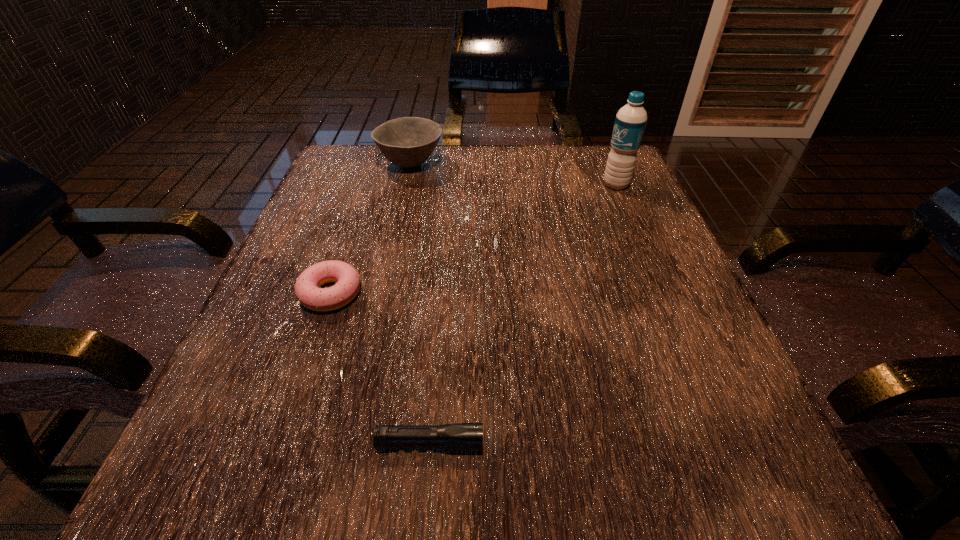
This screenshot has height=540, width=960. Find the location of `free space between the flashlight and the third farthest object`. free space between the flashlight and the third farthest object is located at coordinates click(380, 368).

Locate an element on the screen. The height and width of the screenshot is (540, 960). empty space between the water bottle and the third shortest object is located at coordinates (514, 174).

Identify the location of vacant area between the tallest object and the nearest object. (523, 314).

Locate an element on the screen. The height and width of the screenshot is (540, 960). vacant area between the third tallest object and the bowl is located at coordinates (371, 228).

Locate an element on the screen. unoccupied area between the second tallest object and the rightmost object is located at coordinates (514, 174).

Identify the location of empty space between the bowl and the third tallest object. (371, 228).

Find the location of a particular element. the second closest object relative to the flashlight is located at coordinates (407, 142).

Select which object appears as the closest to the flashlight. Please provide its 2D coordinates. Your answer should be formatted as a tuple, i.e. [(x, y)], where the tuple contains the x and y coordinates of a point satisfying the conditions above.

[(307, 291)]